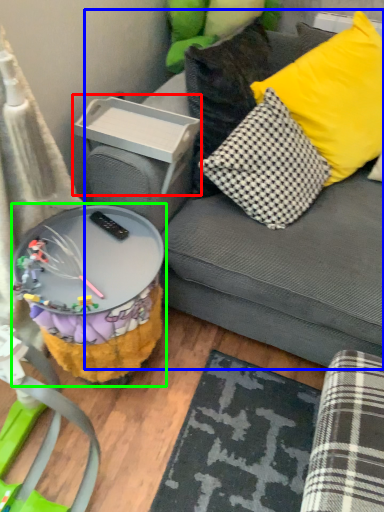
Question: Considering the real-world distances, which object is closest to storage box (highlighted by a red box)? studio couch (highlighted by a blue box) or table (highlighted by a green box).

Choices:
 (A) studio couch
 (B) table

Answer: (A)